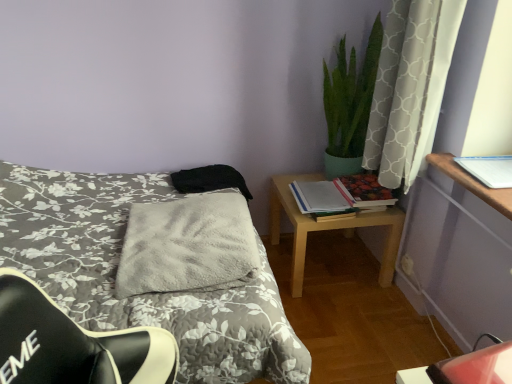
Question: Is matte paper book at center right, the 1th book when ordered from left to right, in front of or behind gray fluffy blanket at center in the image?

Choices:
 (A) front
 (B) behind

Answer: (B)

Question: Considering the positions of matte paper book at center right, the second book from the front, and gray fluffy blanket at center in the image, is matte paper book at center right, the second book from the front, taller or shorter than gray fluffy blanket at center?

Choices:
 (A) tall
 (B) short

Answer: (B)

Question: Which object is positioned farthest from the hardcover book at right, placed as the third book when sorted from front to back?

Choices:
 (A) matte paper book at center right, positioned as the 3th book in right-to-left order
 (B) white paper at upper right, the 3th book positioned from the back
 (C) black fabric pillow at center
 (D) white textured curtain at upper right
 (E) light wood/texture nightstand at right

Answer: (C)

Question: Considering the real-world distances, which object is closest to the gray fluffy blanket at center?

Choices:
 (A) white paper at upper right, the 3th book positioned from the back
 (B) light wood/texture nightstand at right
 (C) matte paper book at center right, the 1th book when ordered from left to right
 (D) black fabric pillow at center
 (E) hardcover book at right, placed as the third book when sorted from front to back

Answer: (D)